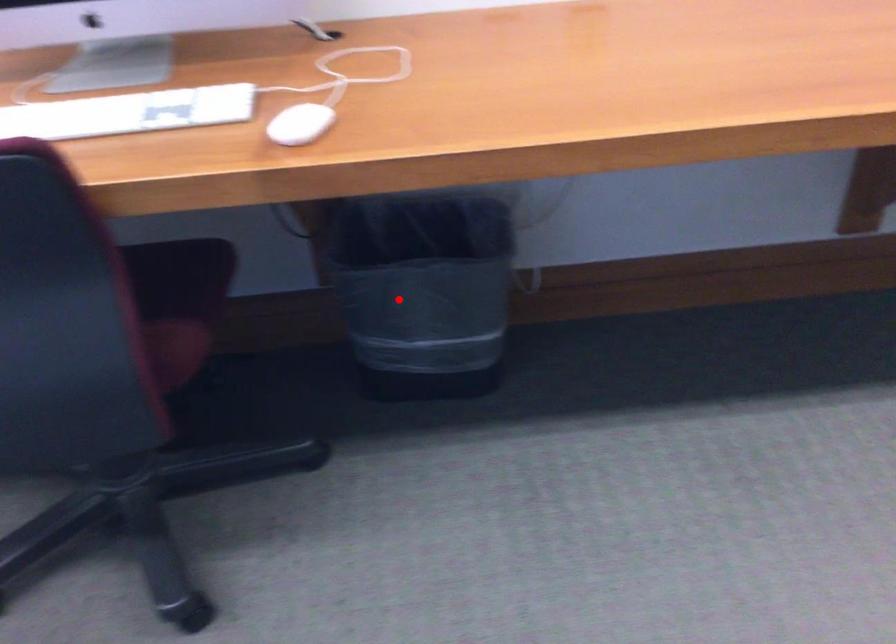
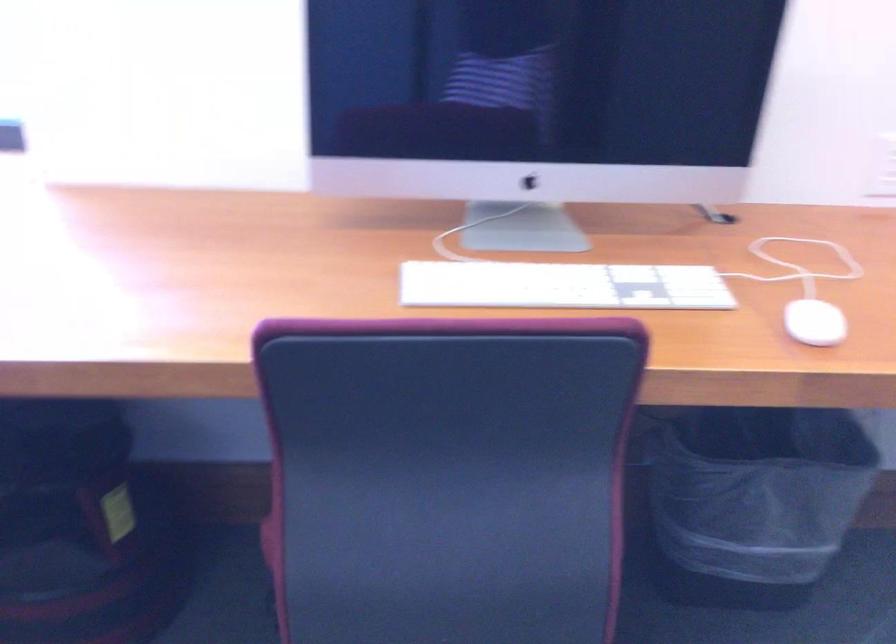
Question: I am providing you with two images of the same scene from different viewpoints. Given a red point in image1, look at the same physical point in image2. Is it:

Choices:
 (A) Closer to the viewpoint
 (B) Farther from the viewpoint

Answer: (A)